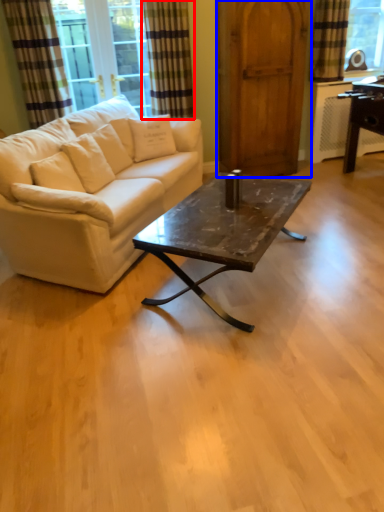
Question: Which of the following is the farthest to the observer, curtain (highlighted by a red box) or barn door (highlighted by a blue box)?

Choices:
 (A) curtain
 (B) barn door

Answer: (A)